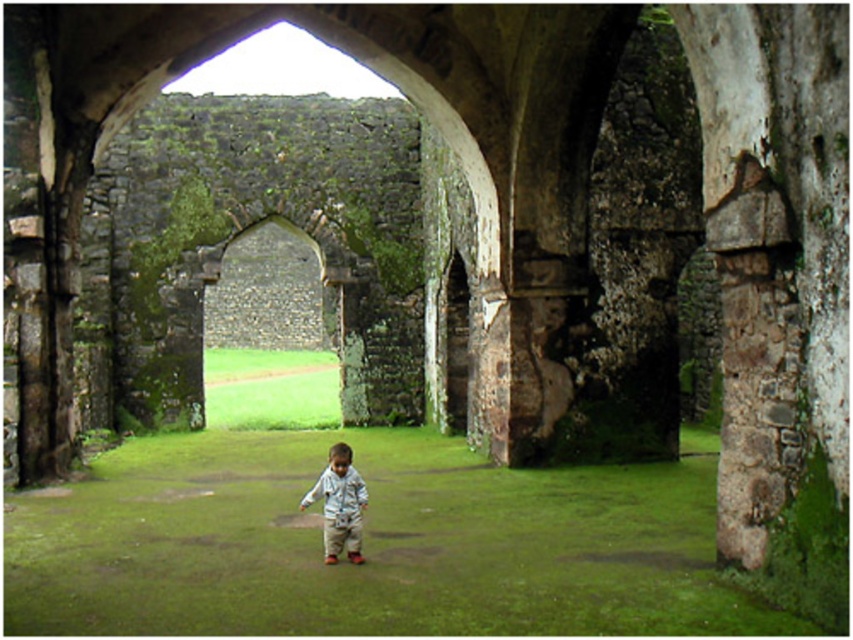
Is green grass at center positioned at the back of light blue fabric boy at center?

No.

Measure the distance from green grass at center to light blue fabric boy at center.

green grass at center and light blue fabric boy at center are 7.94 meters apart.

Locate an element on the screen. The image size is (853, 640). green grass at center is located at coordinates (370, 545).

Locate an element on the screen. The height and width of the screenshot is (640, 853). green grass at center is located at coordinates (370, 545).